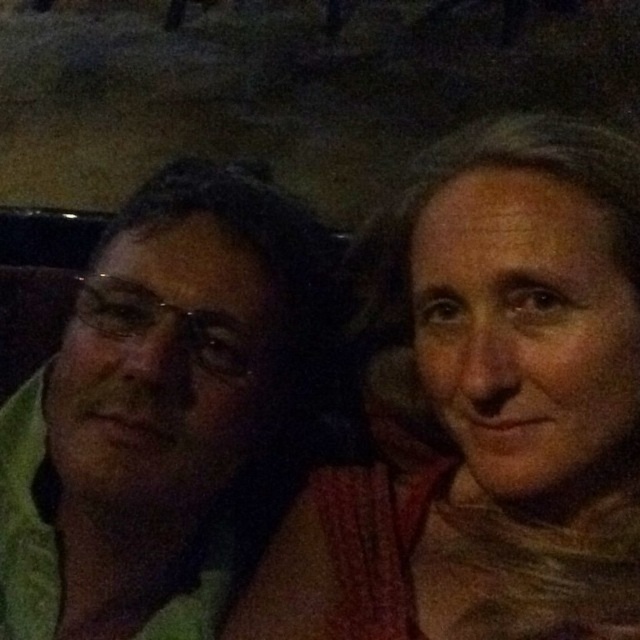
From the picture: You are organizing a clothing donation drive and need to determine which item takes up more space. Based on the image, which item is bigger between the smooth beige scarf at right and the green fabric at left?

The smooth beige scarf at right has a larger size compared to the green fabric at left, so it takes up more space.

You are a photographer trying to adjust the lighting for a portrait. You notice the smooth beige scarf at right and the green fabric at left in the scene. Which object is shorter in height?

The smooth beige scarf at right is not as tall as the green fabric at left, so the smooth beige scarf at right is shorter in height.

You are a photographer trying to adjust the lighting for a portrait. You notice the smooth beige scarf at right and the green fabric at left in the image. Which object should you focus on to ensure the foreground is properly lit?

The smooth beige scarf at right is in front of the green fabric at left, so focusing on the smooth beige scarf at right will ensure proper lighting on the foreground object.